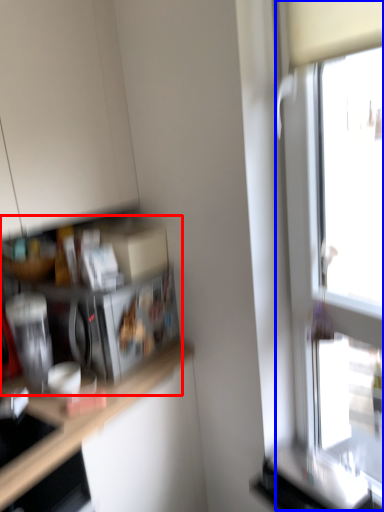
Question: Which object appears closest to the camera in this image, shelf (highlighted by a red box) or window (highlighted by a blue box)?

Choices:
 (A) shelf
 (B) window

Answer: (B)